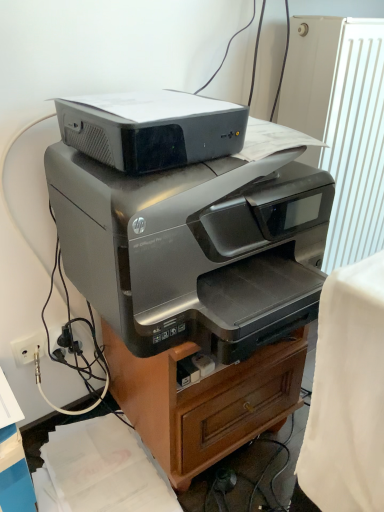
Question: From their relative heights in the image, would you say satin silver printer at center, the second printer from the top, is taller or shorter than white textured radiator at upper right?

Choices:
 (A) short
 (B) tall

Answer: (A)

Question: Based on their positions, is satin silver printer at center, which ranks as the 1th printer in bottom-to-top order, located to the left or right of white textured radiator at upper right?

Choices:
 (A) right
 (B) left

Answer: (B)

Question: Which object is positioned farthest from the matte black printer at upper center, arranged as the 1th printer when viewed from the top?

Choices:
 (A) satin silver printer at center
 (B) white textured radiator at upper right
 (C) satin silver printer at center, the second printer from the top
 (D) black plastic plug at lower left
 (E) white plastic electric outlet at lower left

Answer: (E)

Question: Based on their relative distances, which object is nearer to the white plastic electric outlet at lower left?

Choices:
 (A) black plastic plug at lower left
 (B) white textured radiator at upper right
 (C) satin silver printer at center
 (D) matte black printer at upper center, which appears as the second printer when ordered from the bottom
 (E) satin silver printer at center, the second printer from the top

Answer: (A)